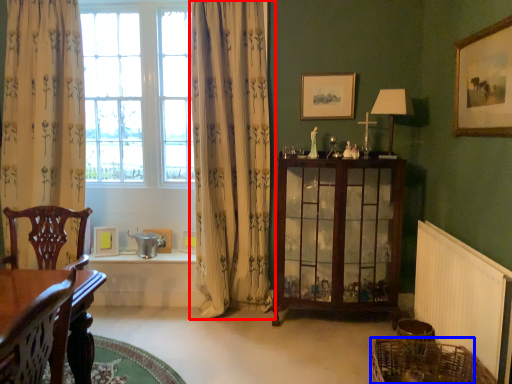
Question: Which object appears closest to the camera in this image, curtain (highlighted by a red box) or basket (highlighted by a blue box)?

Choices:
 (A) curtain
 (B) basket

Answer: (B)